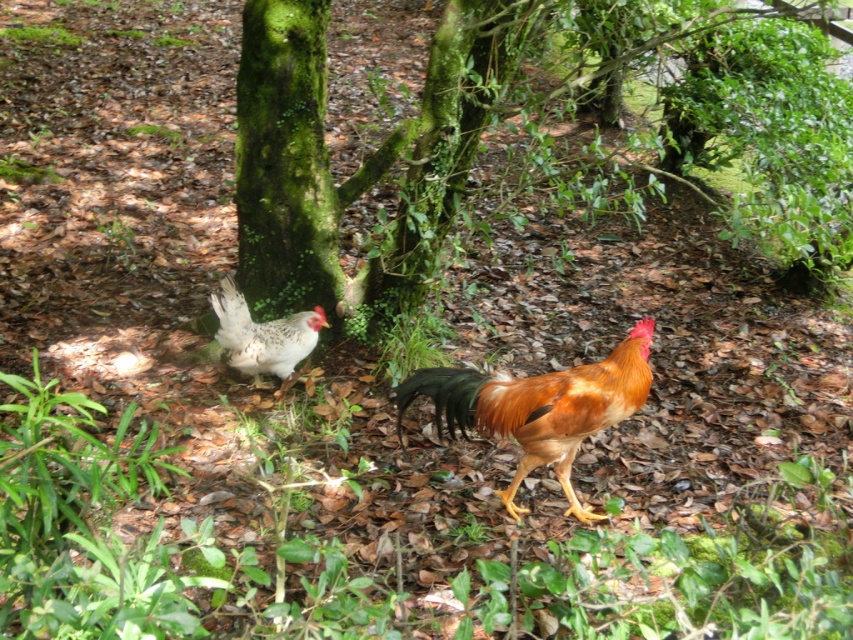
Question: Which object is farther from the camera taking this photo?

Choices:
 (A) speckled feathered chicken at center
 (B) golden brown feathered rooster at center
 (C) green mossy tree at center

Answer: (A)

Question: Among these points, which one is nearest to the camera?

Choices:
 (A) (477, 99)
 (B) (599, 371)
 (C) (281, 371)

Answer: (B)

Question: From the image, what is the correct spatial relationship of green mossy tree at center in relation to golden brown feathered rooster at center?

Choices:
 (A) below
 (B) above

Answer: (B)

Question: Does green mossy tree at center have a greater width compared to golden brown feathered rooster at center?

Choices:
 (A) no
 (B) yes

Answer: (B)

Question: Which of the following is the closest to the observer?

Choices:
 (A) green mossy tree at center
 (B) golden brown feathered rooster at center

Answer: (B)

Question: Does golden brown feathered rooster at center lie behind speckled feathered chicken at center?

Choices:
 (A) yes
 (B) no

Answer: (B)